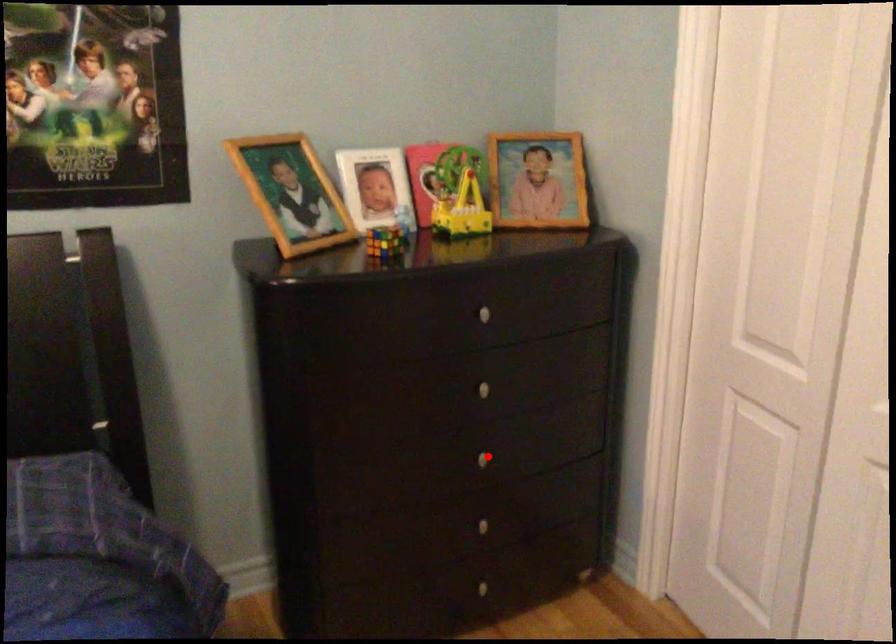
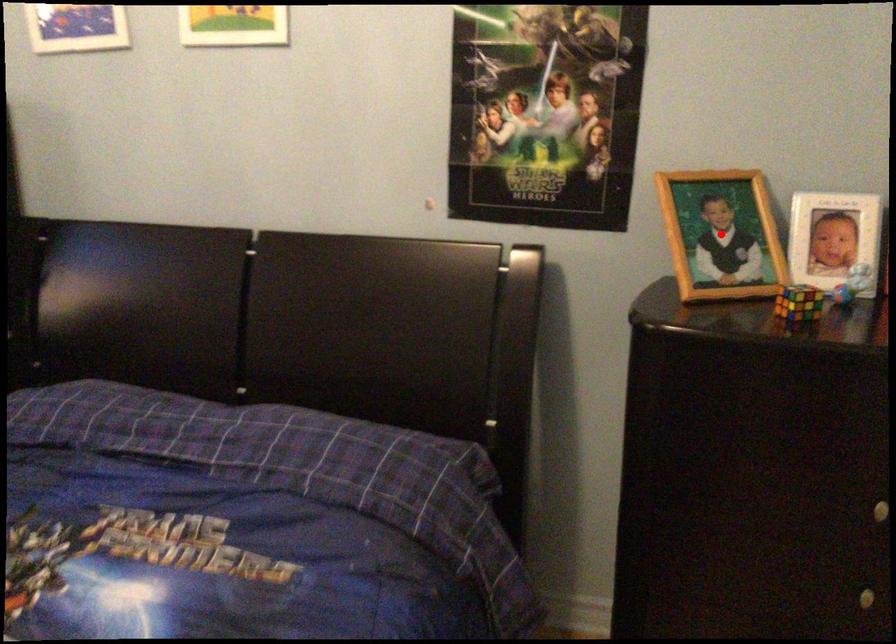
I am providing you with two images of the same scene from different viewpoints. A red point is marked on the first image and another point is marked on the second image. Is the marked point in image1 the same physical position as the marked point in image2?

No